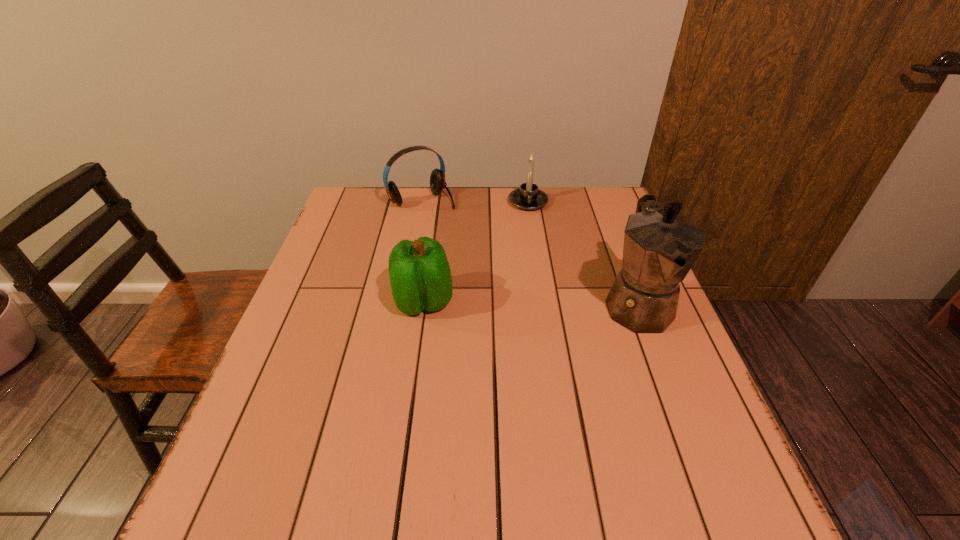
Image resolution: width=960 pixels, height=540 pixels. What are the coordinates of `vacant space situated with the microphone attached to the side of the headset` in the screenshot? It's located at (495, 269).

Where is `free location located with the microphone attached to the side of the headset`? free location located with the microphone attached to the side of the headset is located at coordinates (482, 255).

Find the location of a particular element. The width and height of the screenshot is (960, 540). blank area located with the microphone attached to the side of the headset is located at coordinates (461, 233).

You are a GUI agent. You are given a task and a screenshot of the screen. Output one action in this format:
    pyautogui.click(x=<x>, y=<y>)
    Task: Click on the candle holder present at the far edge
    The image size is (960, 540).
    Given the screenshot: What is the action you would take?
    pyautogui.click(x=528, y=197)

Identify the location of headset that is at the far edge. (437, 179).

You are a GUI agent. You are given a task and a screenshot of the screen. Output one action in this format:
    pyautogui.click(x=<x>, y=<y>)
    Task: Click on the object located at the left edge
    
    Given the screenshot: What is the action you would take?
    click(437, 179)

In order to click on object that is positioned at the right edge in this screenshot , I will do `click(660, 246)`.

Locate an element on the screen. object that is at the far left corner is located at coordinates (437, 179).

The image size is (960, 540). In order to click on free space at the far edge of the desktop in this screenshot , I will do `click(458, 226)`.

The width and height of the screenshot is (960, 540). In order to click on free location at the near edge in this screenshot , I will do `click(392, 455)`.